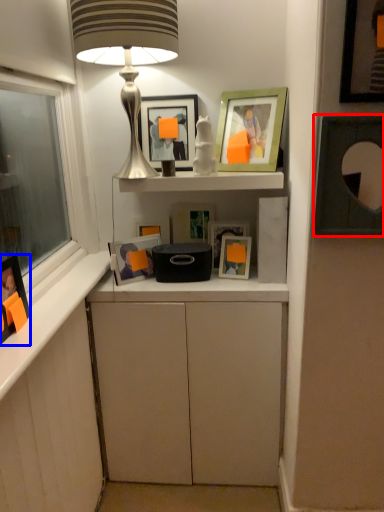
Question: Which of the following is the closest to the observer, picture frame (highlighted by a red box) or picture frame (highlighted by a blue box)?

Choices:
 (A) picture frame
 (B) picture frame

Answer: (B)